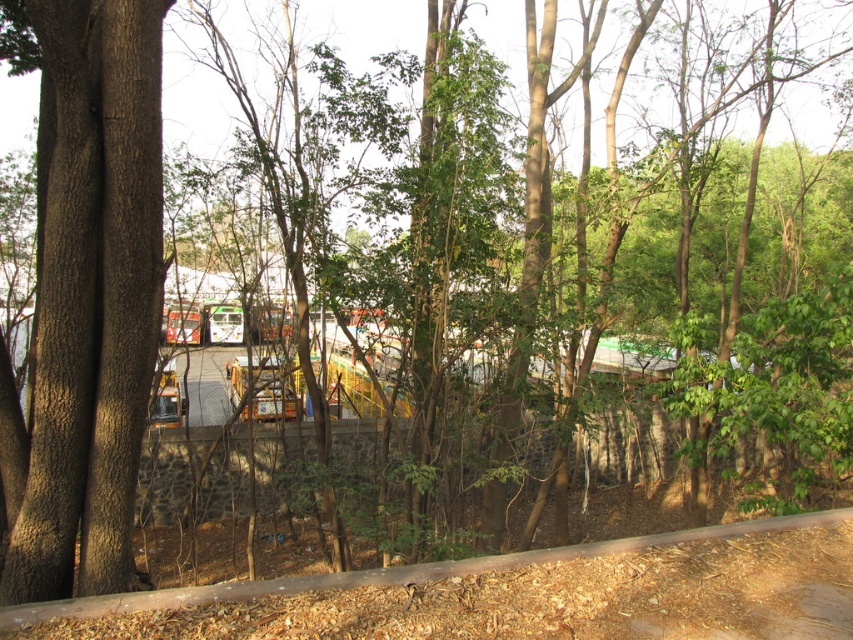
Based on the photo, which of these two, brown rough tree trunk at left or brown dirt track at lower center, stands taller?

With more height is brown rough tree trunk at left.

Can you confirm if brown rough tree trunk at left is taller than brown dirt track at lower center?

Indeed, brown rough tree trunk at left has a greater height compared to brown dirt track at lower center.

Does point (134, 33) come in front of point (520, 609)?

No, it is not.

Where is `brown rough tree trunk at left`? brown rough tree trunk at left is located at coordinates (86, 300).